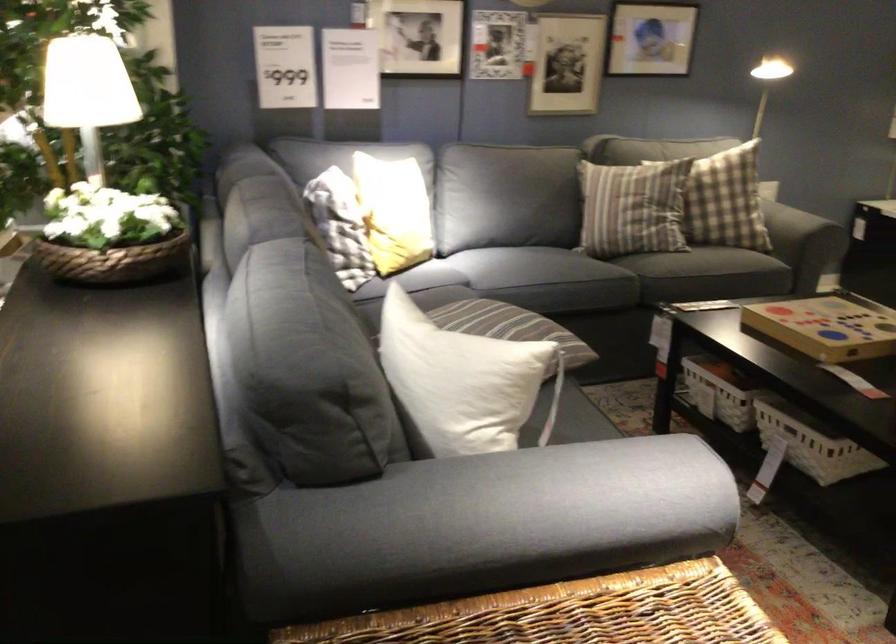
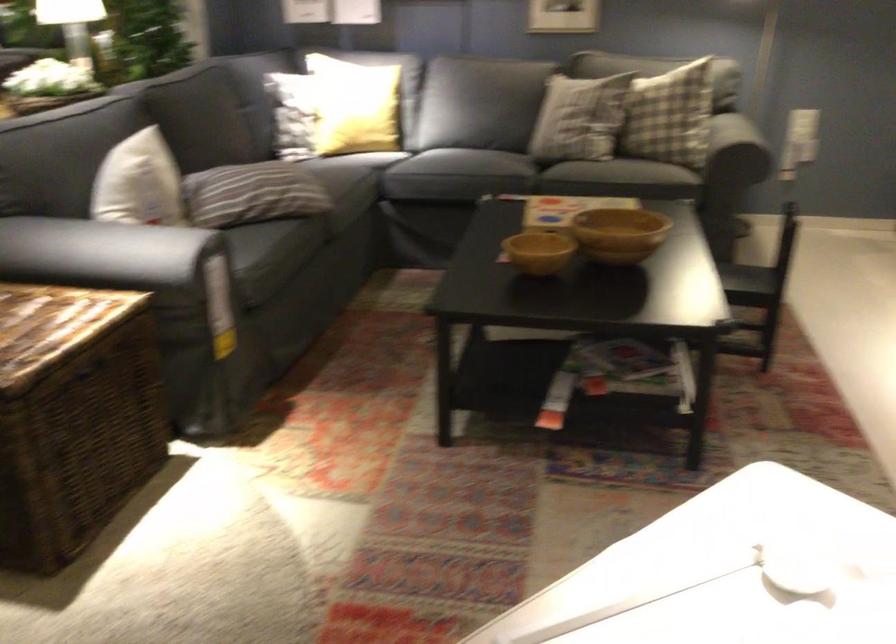
Where in the second image is the point corresponding to (483,265) from the first image?

(386, 149)